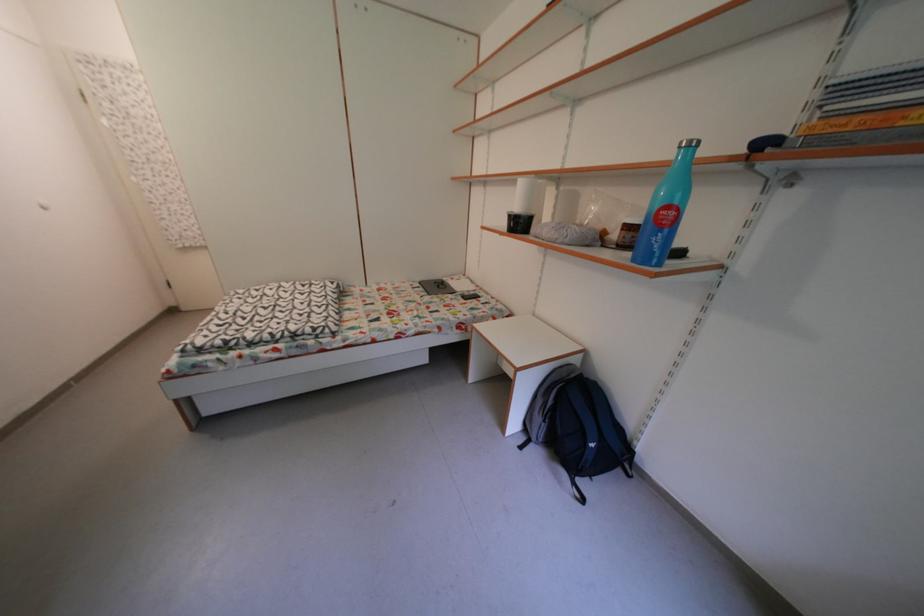
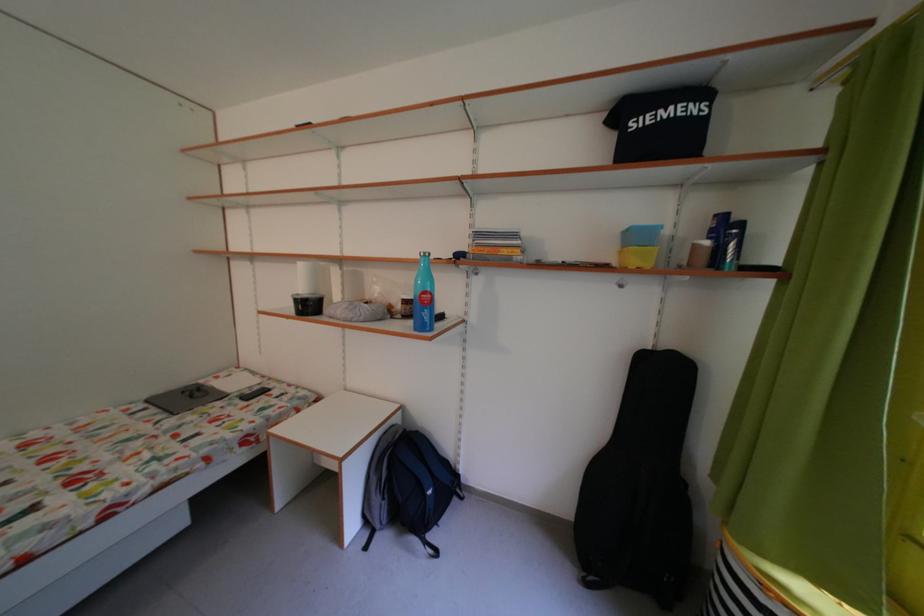
Locate, in the second image, the point that corresponds to pixel 430 289 in the first image.

(156, 407)